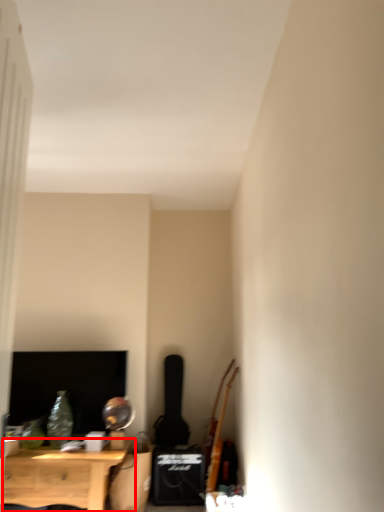
Question: From the image's perspective, what is the correct spatial positioning of nightstand (annotated by the red box) in reference to instrument?

Choices:
 (A) below
 (B) above

Answer: (A)